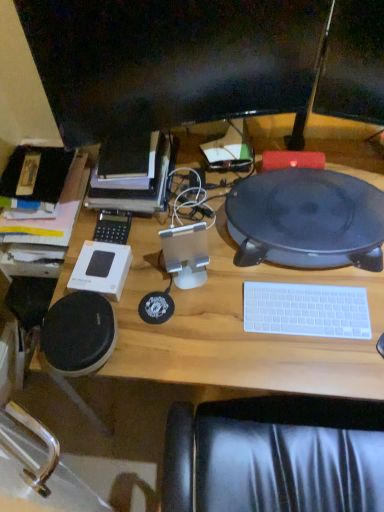
Find the location of a particular element. The height and width of the screenshot is (512, 384). vacant space in front of matte black tablet at center is located at coordinates (290, 330).